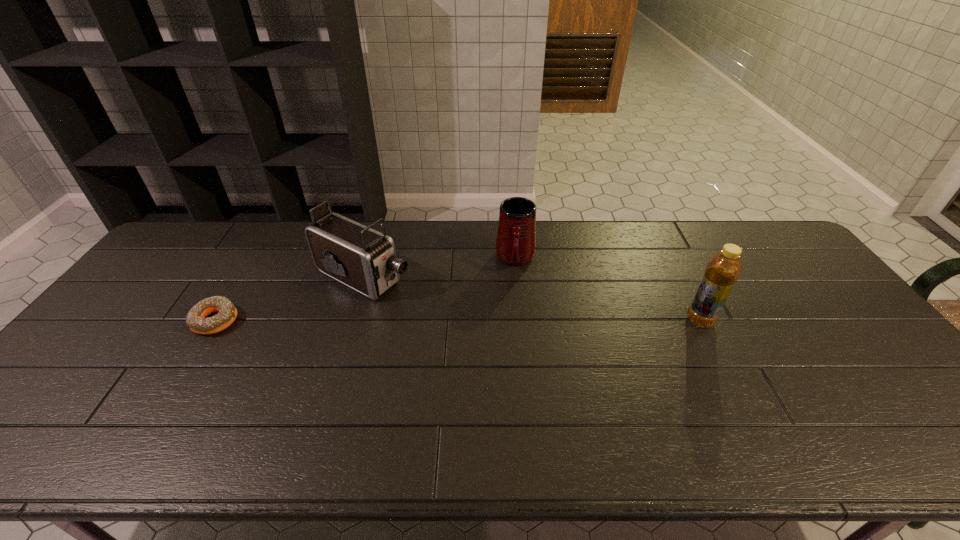
Find the location of `vacant space on the desktop that is between the leftmost object and the bottle and is positioned on the side of the third object from left to right with the handle`. vacant space on the desktop that is between the leftmost object and the bottle and is positioned on the side of the third object from left to right with the handle is located at coordinates (512, 321).

Where is `free space on the desktop that is between the shortest object and the bottle and is positioned at the lens of the second object from left to right`? The image size is (960, 540). free space on the desktop that is between the shortest object and the bottle and is positioned at the lens of the second object from left to right is located at coordinates (450, 321).